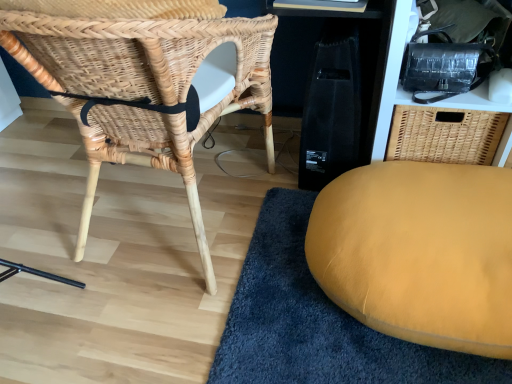
In order to click on free space between mustard yellow cushion at lower right and natural woven chair at left in this screenshot , I will do `click(271, 265)`.